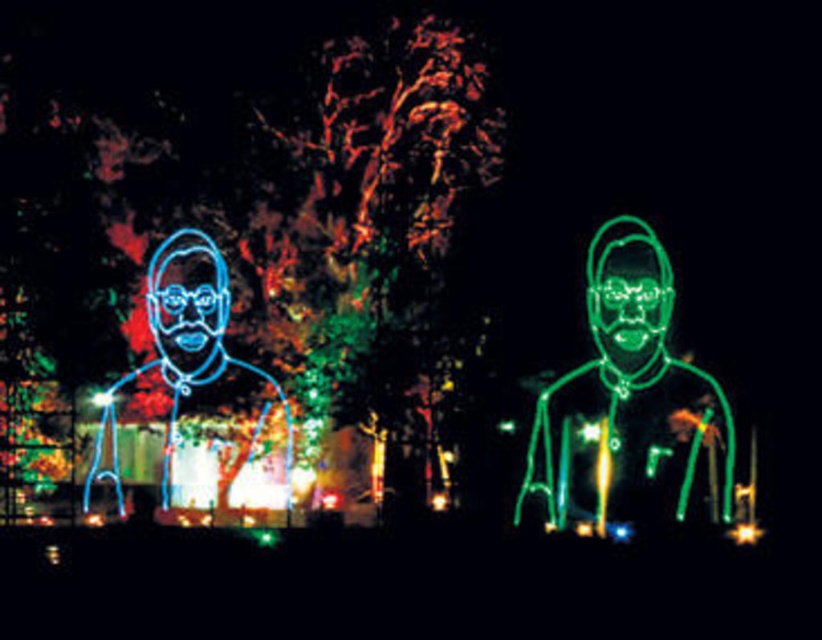
You are an artist trying to capture this scene. You want to focus on the neon green face at center and neon blue face at left. Which one should you zoom in on first if you want to depict the closer object in detail?

The neon green face at center is closer to the viewer than the neon blue face at left, so you should zoom in on the neon green face at center first to depict the closer object in detail.

You are a photographer standing at the center of the scene. You want to capture both the neon green face at center and the neon blue face at left in a single wide shot. Given that your camera has a maximum focal length of 50 meters, will you be able to include both faces in the frame?

The neon green face at center and neon blue face at left are 45.64 meters apart from each other. Since your camera can capture up to 50 meters, you can include both faces in the frame as the distance between them is within the camera range.

You are an artist planning to paint this scene. You want to place a new red star sticker between the neon green wireframe figure at center and the blue neon sign at left. Based on their current positions, which object should the sticker be closer to?

The neon green wireframe figure at center is positioned on the right side of blue neon sign at left, so the sticker should be placed closer to the blue neon sign at left since it is to the left of the neon green wireframe figure at center.